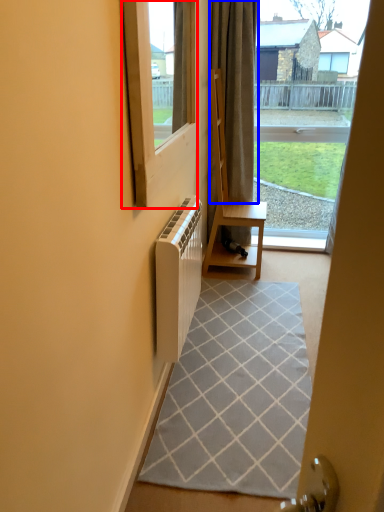
Question: Which object is further to the camera taking this photo, window (highlighted by a red box) or curtain (highlighted by a blue box)?

Choices:
 (A) window
 (B) curtain

Answer: (B)